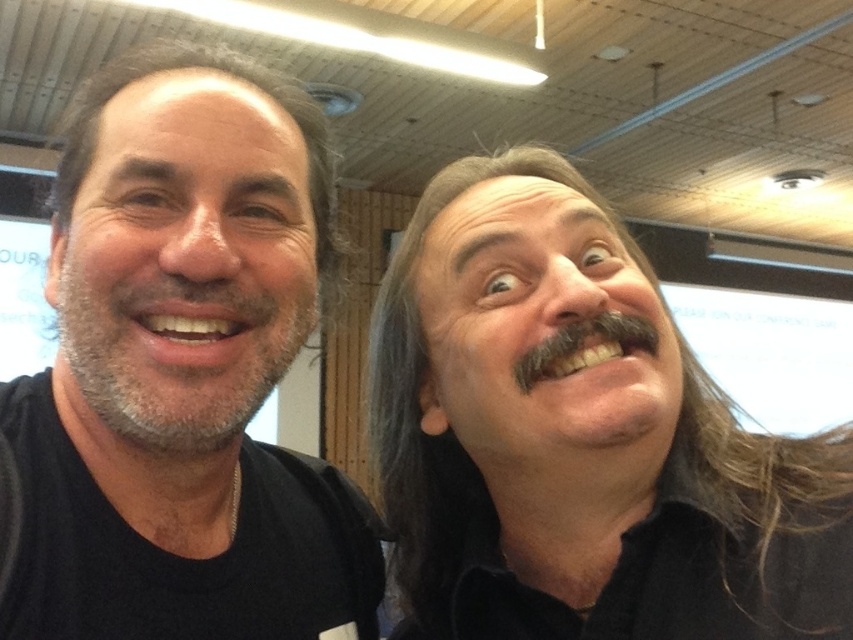
Question: Does matte black shirt at left come in front of smooth skin face at center?

Choices:
 (A) yes
 (B) no

Answer: (A)

Question: Can you confirm if matte black shirt at left is positioned to the right of black matte mustache at right?

Choices:
 (A) yes
 (B) no

Answer: (B)

Question: Estimate the real-world distances between objects in this image. Which object is farther from the matte black shirt at left?

Choices:
 (A) smooth skin face at left
 (B) black matte mustache at right

Answer: (B)

Question: Estimate the real-world distances between objects in this image. Which object is closer to the smooth skin face at center?

Choices:
 (A) smooth skin face at left
 (B) black matte mustache at right

Answer: (B)

Question: Is matte black shirt at left above black matte mustache at right?

Choices:
 (A) no
 (B) yes

Answer: (B)

Question: Among these objects, which one is farthest from the camera?

Choices:
 (A) black matte mustache at right
 (B) matte black shirt at left
 (C) smooth skin face at center
 (D) smooth skin face at left

Answer: (C)